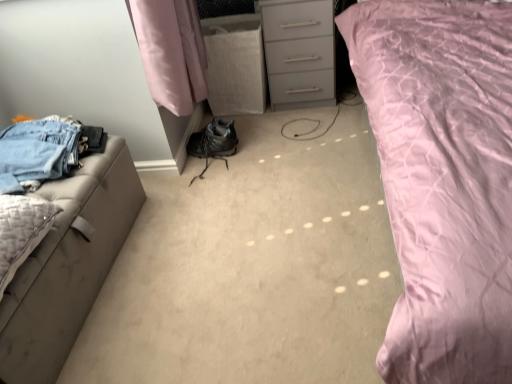
Question: Can you confirm if matte gray chest of drawers at center is taller than textured beige pillow at left?

Choices:
 (A) no
 (B) yes

Answer: (B)

Question: Is textured beige pillow at left a part of matte gray chest of drawers at center?

Choices:
 (A) yes
 (B) no

Answer: (B)

Question: Is matte gray chest of drawers at center in front of textured beige pillow at left?

Choices:
 (A) no
 (B) yes

Answer: (A)

Question: Is matte gray chest of drawers at center shorter than textured beige pillow at left?

Choices:
 (A) no
 (B) yes

Answer: (A)

Question: Is matte gray chest of drawers at center at the left side of textured beige pillow at left?

Choices:
 (A) yes
 (B) no

Answer: (B)

Question: From the image's perspective, is matte gray chest of drawers at center under textured beige pillow at left?

Choices:
 (A) no
 (B) yes

Answer: (A)

Question: Is pink quilted fabric at upper right inside textured beige pillow at left?

Choices:
 (A) no
 (B) yes

Answer: (A)

Question: Can you confirm if textured beige pillow at left is smaller than pink quilted fabric at upper right?

Choices:
 (A) no
 (B) yes

Answer: (B)

Question: From the image's perspective, is textured beige pillow at left beneath pink quilted fabric at upper right?

Choices:
 (A) yes
 (B) no

Answer: (A)

Question: From a real-world perspective, is textured beige pillow at left positioned under pink quilted fabric at upper right based on gravity?

Choices:
 (A) no
 (B) yes

Answer: (B)

Question: Does textured beige pillow at left have a lesser height compared to pink quilted fabric at upper right?

Choices:
 (A) yes
 (B) no

Answer: (A)

Question: Are textured beige pillow at left and pink quilted fabric at upper right located far from each other?

Choices:
 (A) no
 (B) yes

Answer: (B)

Question: Is textured beige pillow at left behind denim jeans at left?

Choices:
 (A) no
 (B) yes

Answer: (A)